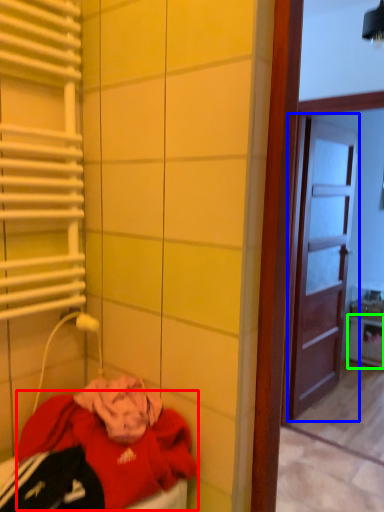
Question: Which object is positioned closest to clothing (highlighted by a red box)? Select from door (highlighted by a blue box) and cabinetry (highlighted by a green box).

Choices:
 (A) door
 (B) cabinetry

Answer: (A)